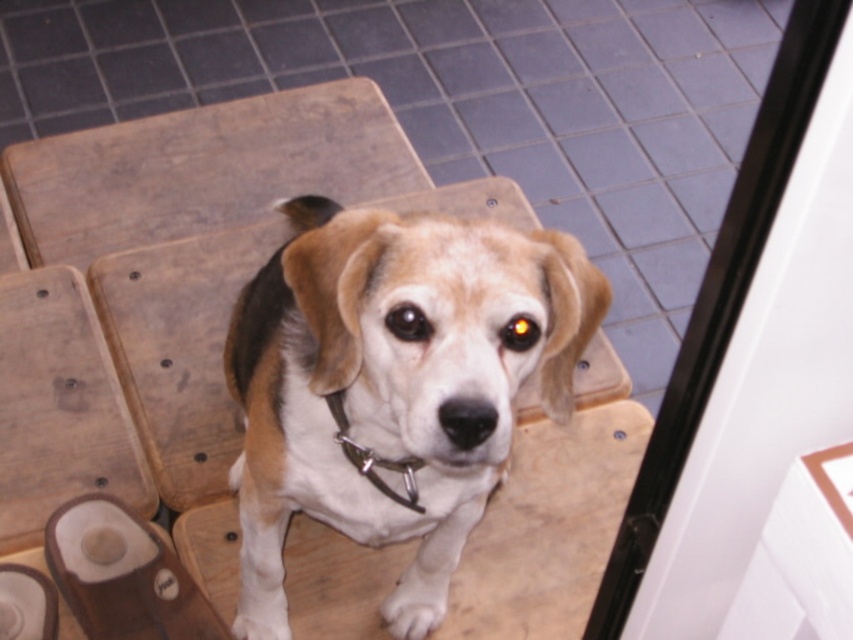
You are standing in the tiled room and want to place a new decorative item at point (123, 576). What object is currently located at that point?

The point (123, 576) is occupied by a light brown leather sandal at lower left.

You are standing in the room and want to exit through the transparent glass door at upper right. However, there is a light brown leather sandal at lower left in your way. Can you step around the sandal to reach the door without moving it?

The transparent glass door at upper right is positioned over the light brown leather sandal at lower left, meaning the door is above the sandal. Since the sandal is on the floor and the door is higher up, you can easily step around the sandal to reach the door without moving it.

You are a photographer setting up a shoot in the room. You have a small tripod that can only hold objects up to the size of the light brown leather sandal at lower left. Can the brown and white fur dog at center be placed on the tripod?

The brown and white fur dog at center has a larger size compared to the light brown leather sandal at lower left, so it cannot be placed on the tripod since it exceeds the tripod capacity.